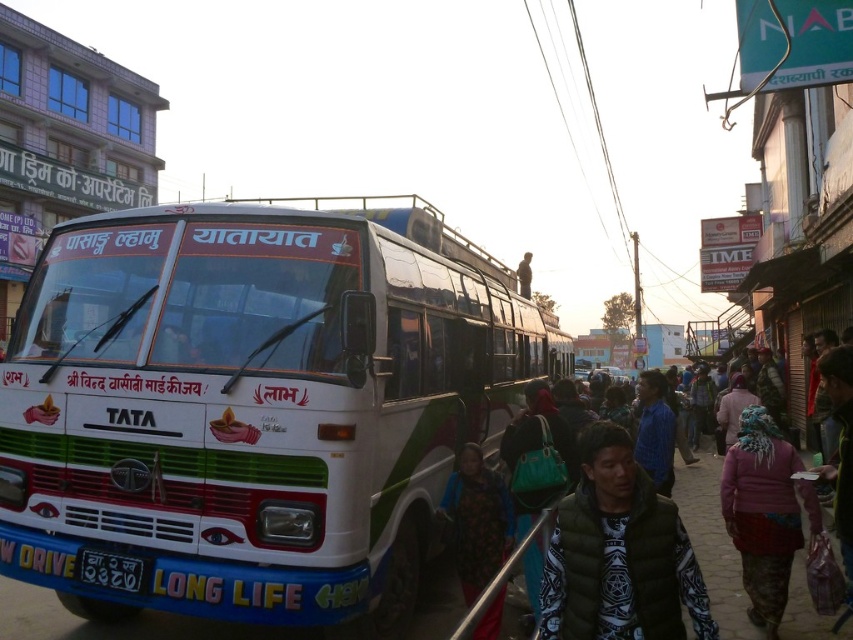
Is point (782, 476) farther from camera compared to point (94, 568)?

Yes, it is behind point (94, 568).

Is pink fabric headscarf at lower right smaller than white plastic license plate at lower left?

Actually, pink fabric headscarf at lower right might be larger than white plastic license plate at lower left.

Where is `pink fabric headscarf at lower right`? The image size is (853, 640). pink fabric headscarf at lower right is located at coordinates (762, 513).

Is point (401, 589) positioned after point (105, 566)?

Yes, it is.

Between white glossy bus at center and white plastic license plate at lower left, which one has less height?

With less height is white plastic license plate at lower left.

The height and width of the screenshot is (640, 853). Identify the location of white glossy bus at center. (254, 406).

Can you confirm if floral fabric shawl at center is shorter than white plastic license plate at lower left?

No, floral fabric shawl at center is not shorter than white plastic license plate at lower left.

Is floral fabric shawl at center positioned in front of white plastic license plate at lower left?

No, it is behind white plastic license plate at lower left.

Image resolution: width=853 pixels, height=640 pixels. What do you see at coordinates (476, 520) in the screenshot?
I see `floral fabric shawl at center` at bounding box center [476, 520].

Where is `floral fabric shawl at center`? The image size is (853, 640). floral fabric shawl at center is located at coordinates (476, 520).